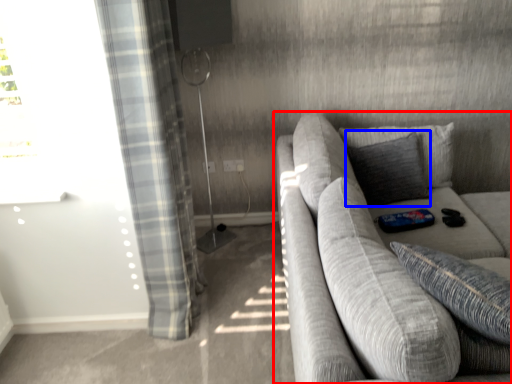
Question: Among these objects, which one is farthest to the camera, studio couch (highlighted by a red box) or pillow (highlighted by a blue box)?

Choices:
 (A) studio couch
 (B) pillow

Answer: (B)